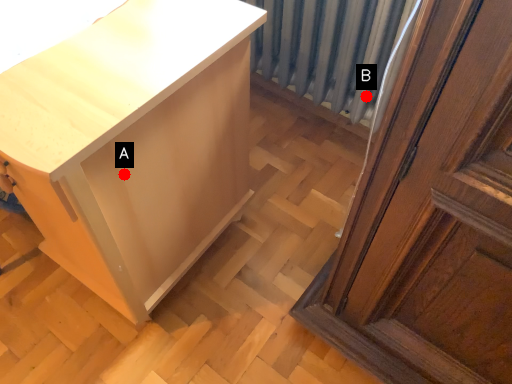
Question: Two points are circled on the image, labeled by A and B beside each circle. Which point is further to the camera?

Choices:
 (A) A is further
 (B) B is further

Answer: (B)